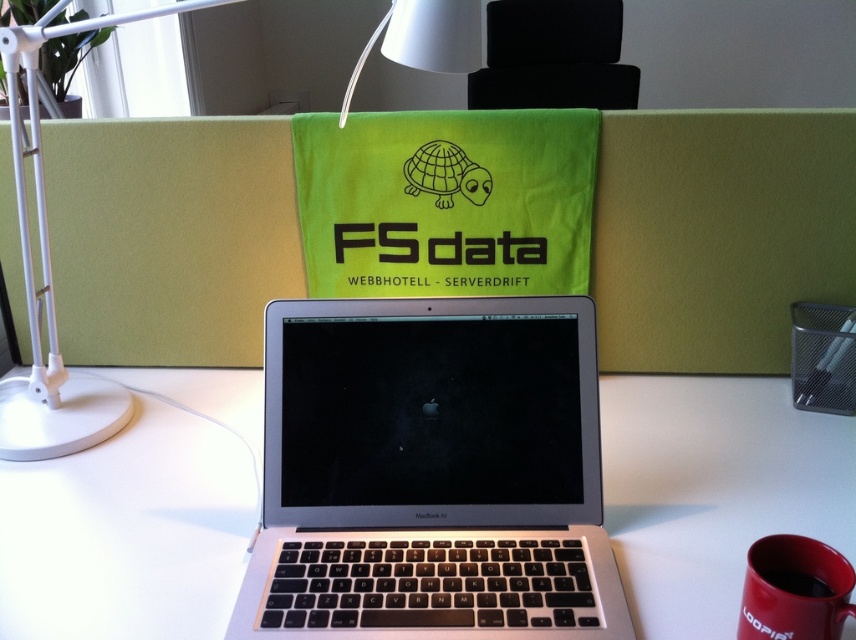
You are organizing the desk in the image. You need to place a new item between the black matte turtle at center and the red matte coffee cup at lower right. Where should you place it to ensure it is between them?

The new item should be placed between the black matte turtle at center and the red matte coffee cup at lower right, positioned below the black matte turtle at center and above the red matte coffee cup at lower right since the turtle is above the cup.

You are standing in front of the workspace shown in the image. You want to place a 12 inch by 12 inch square box on the white matte table at center. Will the box fit on the table without overhanging the edges?

The white matte table at center is 26.92 inches from viewer. This distance does not provide information about the table size. The question cannot be answered with the given information.